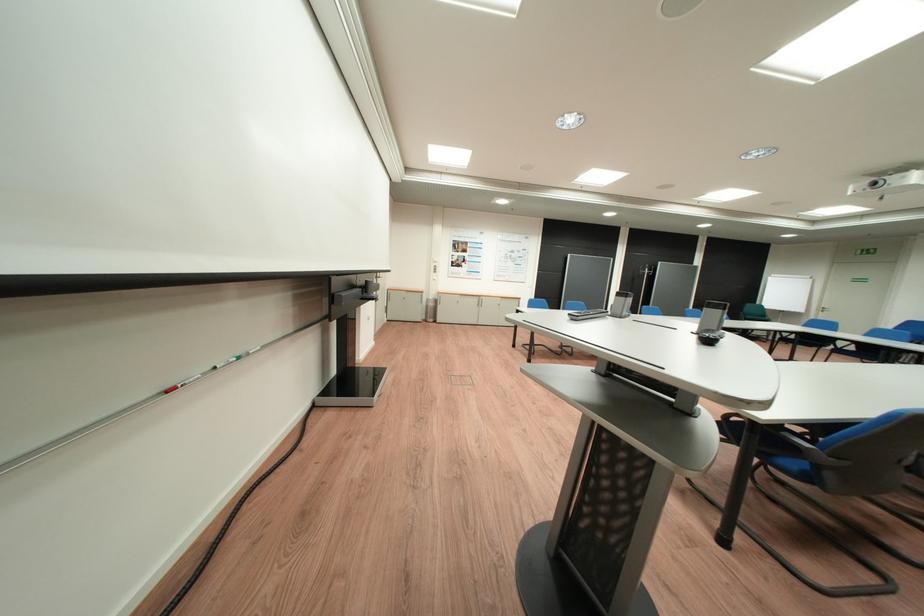
The width and height of the screenshot is (924, 616). I want to click on red whiteboard marker, so click(x=181, y=384).